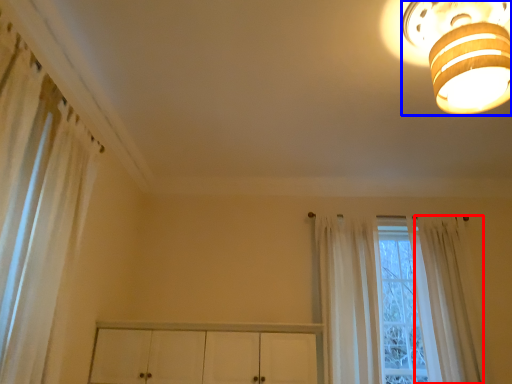
Question: Which point is further to the camera, curtain (highlighted by a red box) or lamp (highlighted by a blue box)?

Choices:
 (A) curtain
 (B) lamp

Answer: (A)